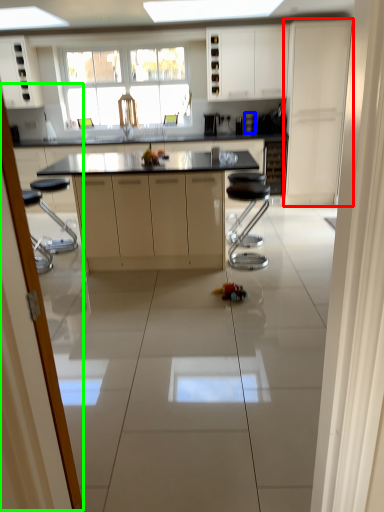
Question: Based on their relative distances, which object is nearer to cabinetry (highlighted by a red box)? Choose from appliance (highlighted by a blue box) and screen door (highlighted by a green box).

Choices:
 (A) appliance
 (B) screen door

Answer: (A)